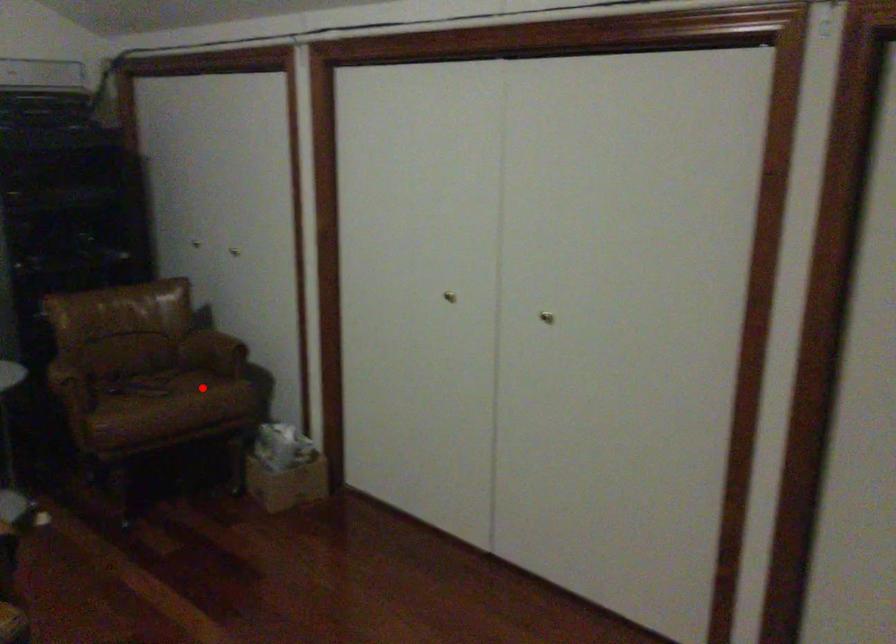
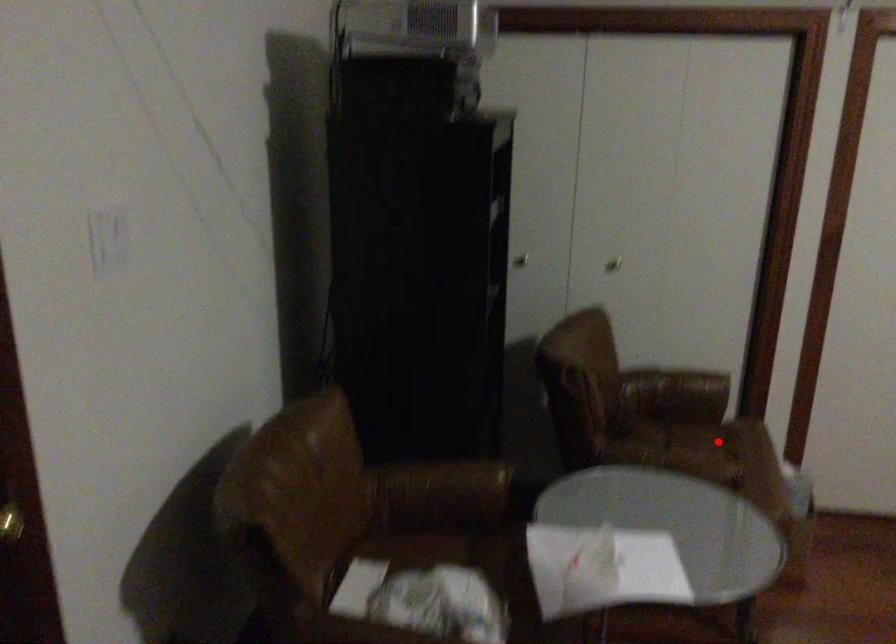
I am providing you with two images of the same scene from different viewpoints. A red point is marked on the first image and another point is marked on the second image. Does the point marked in image1 correspond to the same location as the one in image2?

Yes